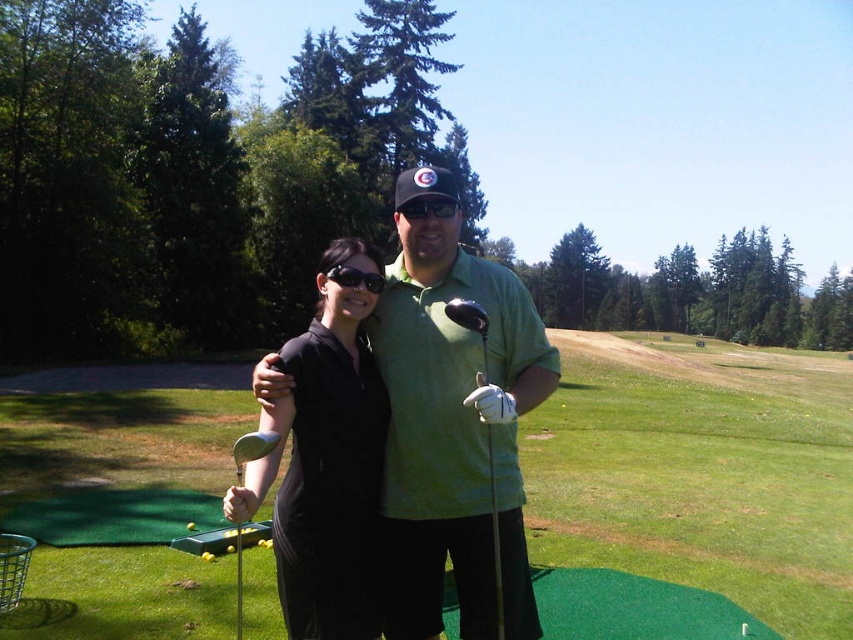
Based on the coordinates provided, which object is exactly at point (700, 472)?

The green artificial turf at center is exactly at point (700, 472).

You are a photographer trying to capture a clear shot of both the black matte golf club at center and the black matte cap at center. Since they are both in the center, will the golf club block the view of the cap in your photo?

The black matte golf club at center is in front of the black matte cap at center, so the golf club will block the view of the cap in the photo.

You are a photographer setting up for a group photo at the golf driving range. You need to position two people so that one stands on the green artificial turf at center and the other stands on the shiny black metal golf club at center. Is this possible given their positions?

The green artificial turf at center is positioned on the right side of the shiny black metal golf club at center, so both objects are in the same central area. However, since the golf club is an object and not a surface, it cannot support a person standing on it. Therefore, only one person can stand on the green artificial turf at center while the other must stand elsewhere.